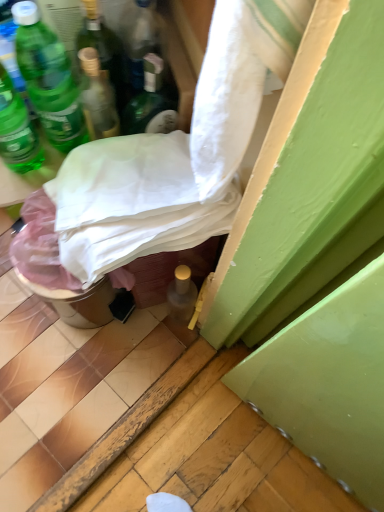
Question: Is green matte bottle at upper left, the 3th bottle from the left, further to camera compared to green glass bottle at upper left, the 5th bottle viewed from the right?

Choices:
 (A) yes
 (B) no

Answer: (A)

Question: Is green matte bottle at upper left, the 3th bottle from the left, completely or partially outside of green glass bottle at upper left, the 5th bottle viewed from the right?

Choices:
 (A) yes
 (B) no

Answer: (A)

Question: Could you tell me if green matte bottle at upper left, arranged as the 3th bottle when viewed from the right, is turned towards green glass bottle at upper left, the 1th bottle from the left?

Choices:
 (A) yes
 (B) no

Answer: (B)

Question: Does green matte bottle at upper left, arranged as the 3th bottle when viewed from the right, have a smaller size compared to green glass bottle at upper left, the 1th bottle from the left?

Choices:
 (A) yes
 (B) no

Answer: (A)

Question: From a real-world perspective, is green matte bottle at upper left, arranged as the 3th bottle when viewed from the right, below green glass bottle at upper left, the 5th bottle viewed from the right?

Choices:
 (A) no
 (B) yes

Answer: (A)

Question: Is green glass bottle at upper left, which is counted as the fourth bottle, starting from the left, bigger or smaller than white fabric at center?

Choices:
 (A) big
 (B) small

Answer: (B)

Question: Looking at their shapes, would you say green glass bottle at upper left, which appears as the 2th bottle when viewed from the right, is wider or thinner than white fabric at center?

Choices:
 (A) wide
 (B) thin

Answer: (B)

Question: Is green glass bottle at upper left, which appears as the 2th bottle when viewed from the right, inside or outside of white fabric at center?

Choices:
 (A) outside
 (B) inside

Answer: (A)

Question: Relative to white fabric at center, is green glass bottle at upper left, which is counted as the fourth bottle, starting from the left, in front or behind?

Choices:
 (A) behind
 (B) front

Answer: (A)

Question: Which is correct: green matte bottle at upper left, arranged as the 3th bottle when viewed from the right, is inside green glass bottle at upper left, which appears as the 2th bottle when viewed from the right, or outside of it?

Choices:
 (A) inside
 (B) outside

Answer: (B)

Question: From the image's perspective, is green matte bottle at upper left, arranged as the 3th bottle when viewed from the right, above or below green glass bottle at upper left, which is counted as the fourth bottle, starting from the left?

Choices:
 (A) above
 (B) below

Answer: (B)

Question: Is green matte bottle at upper left, the 3th bottle from the left, taller or shorter than green glass bottle at upper left, which appears as the 2th bottle when viewed from the right?

Choices:
 (A) short
 (B) tall

Answer: (B)

Question: Is green matte bottle at upper left, arranged as the 3th bottle when viewed from the right, in front of or behind green glass bottle at upper left, which is counted as the fourth bottle, starting from the left, in the image?

Choices:
 (A) behind
 (B) front

Answer: (B)

Question: Does point (43, 44) appear closer or farther from the camera than point (28, 159)?

Choices:
 (A) closer
 (B) farther

Answer: (A)

Question: Considering the relative positions of green matte bottle at upper left, arranged as the 3th bottle when viewed from the right, and green glass bottle at upper left, the 5th bottle viewed from the right, in the image provided, is green matte bottle at upper left, arranged as the 3th bottle when viewed from the right, to the left or to the right of green glass bottle at upper left, the 5th bottle viewed from the right,?

Choices:
 (A) left
 (B) right

Answer: (B)